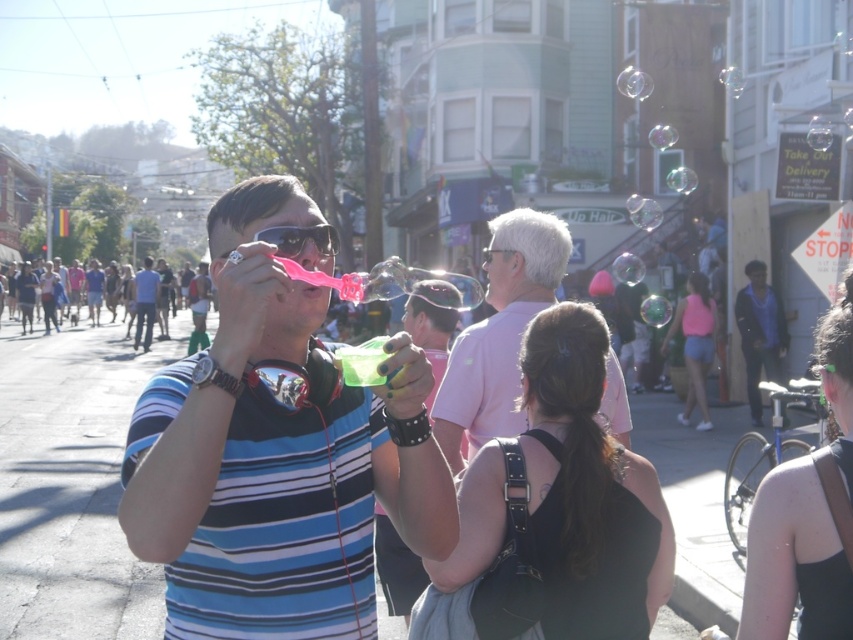
Does pink matte bubble wand at center appear on the right side of matte black goggles at center?

Indeed, pink matte bubble wand at center is positioned on the right side of matte black goggles at center.

Who is more forward, (561,257) or (305,236)?

Point (305,236)

You are a GUI agent. You are given a task and a screenshot of the screen. Output one action in this format:
    pyautogui.click(x=<x>, y=<y>)
    Task: Click on the pink matte bubble wand at center
    
    Given the screenshot: What is the action you would take?
    pyautogui.click(x=498, y=333)

Between point (773, 557) and point (663, 340), which one is positioned in front?

Positioned in front is point (773, 557).

Who is more forward, (850, 541) or (692, 276)?

Point (850, 541) is more forward.

Image resolution: width=853 pixels, height=640 pixels. Find the location of `black fabric hair at upper right`. black fabric hair at upper right is located at coordinates (807, 513).

Does striped cotton shirt at center appear on the left side of black fabric hair at upper right?

Indeed, striped cotton shirt at center is positioned on the left side of black fabric hair at upper right.

Between point (248, 230) and point (827, 560), which one is positioned behind?

The point (248, 230) is more distant.

Is point (410, 344) positioned behind point (762, 625)?

No.

At what (x,y) coordinates should I click in order to perform the action: click on striped cotton shirt at center. Please return your answer as a coordinate pair (x, y). The height and width of the screenshot is (640, 853). Looking at the image, I should click on (276, 456).